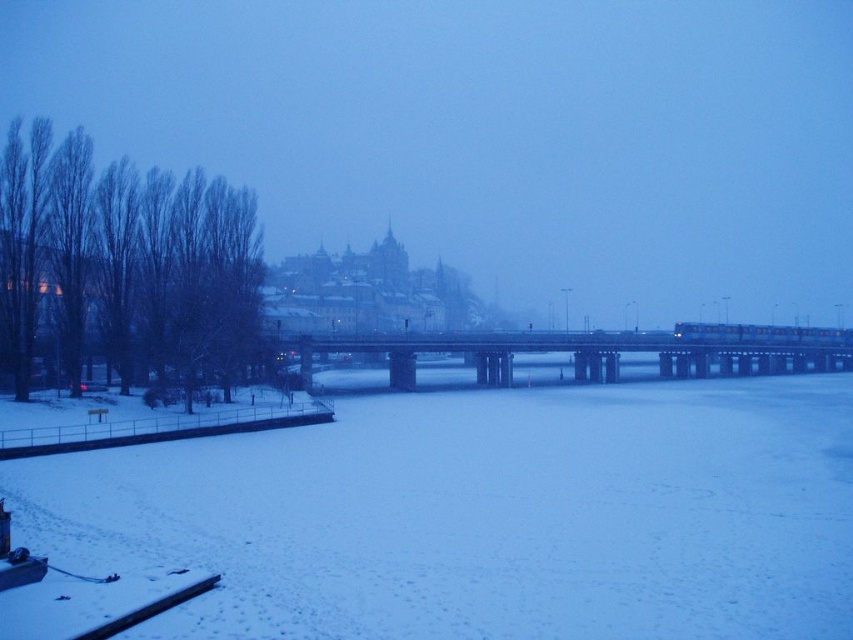
Question: Can you confirm if white powdery snow at center is positioned to the left of concrete bridge at center?

Choices:
 (A) yes
 (B) no

Answer: (A)

Question: Which object appears farthest from the camera in this image?

Choices:
 (A) white powdery snow at center
 (B) concrete bridge at center

Answer: (B)

Question: Is white powdery snow at center positioned behind concrete bridge at center?

Choices:
 (A) yes
 (B) no

Answer: (B)

Question: Does white powdery snow at center appear on the left side of concrete bridge at center?

Choices:
 (A) no
 (B) yes

Answer: (B)

Question: Among these points, which one is farthest from the camera?

Choices:
 (A) (711, 412)
 (B) (399, 381)

Answer: (B)